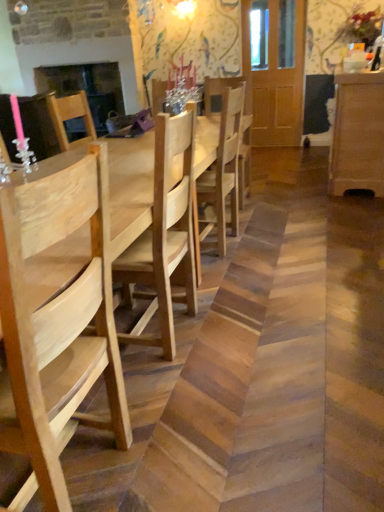
Question: Is natural wood chair at center, marked as the 1th chair in a back-to-front arrangement, facing towards matte black fireplace at upper left?

Choices:
 (A) yes
 (B) no

Answer: (B)

Question: Is natural wood chair at center, marked as the 1th chair in a back-to-front arrangement, shorter than matte black fireplace at upper left?

Choices:
 (A) yes
 (B) no

Answer: (A)

Question: Does natural wood chair at center, which appears as the 1th chair when viewed from the right, have a greater height compared to matte black fireplace at upper left?

Choices:
 (A) no
 (B) yes

Answer: (A)

Question: From a real-world perspective, is natural wood chair at center, marked as the 1th chair in a back-to-front arrangement, below matte black fireplace at upper left?

Choices:
 (A) no
 (B) yes

Answer: (B)

Question: Does natural wood chair at center, arranged as the second chair when viewed from the left, lie in front of matte black fireplace at upper left?

Choices:
 (A) yes
 (B) no

Answer: (A)

Question: From the image's perspective, is natural wood chair at center, which appears as the 1th chair when viewed from the right, located beneath matte black fireplace at upper left?

Choices:
 (A) no
 (B) yes

Answer: (B)

Question: Considering the relative positions of natural wood table at center and light brown wood dresser at right in the image provided, is natural wood table at center behind light brown wood dresser at right?

Choices:
 (A) yes
 (B) no

Answer: (B)

Question: From the image's perspective, is natural wood table at center below light brown wood dresser at right?

Choices:
 (A) yes
 (B) no

Answer: (A)

Question: From a real-world perspective, is natural wood table at center on light brown wood dresser at right?

Choices:
 (A) no
 (B) yes

Answer: (A)

Question: Considering the relative sizes of natural wood table at center and light brown wood dresser at right in the image provided, is natural wood table at center bigger than light brown wood dresser at right?

Choices:
 (A) yes
 (B) no

Answer: (A)

Question: From a real-world perspective, is natural wood table at center located beneath light brown wood dresser at right?

Choices:
 (A) no
 (B) yes

Answer: (B)

Question: From the image's perspective, is natural wood table at center over light brown wood dresser at right?

Choices:
 (A) yes
 (B) no

Answer: (B)

Question: Considering the relative sizes of natural wood chair at center, marked as the 1th chair in a back-to-front arrangement, and light brown wood dresser at right in the image provided, is natural wood chair at center, marked as the 1th chair in a back-to-front arrangement, bigger than light brown wood dresser at right?

Choices:
 (A) no
 (B) yes

Answer: (A)